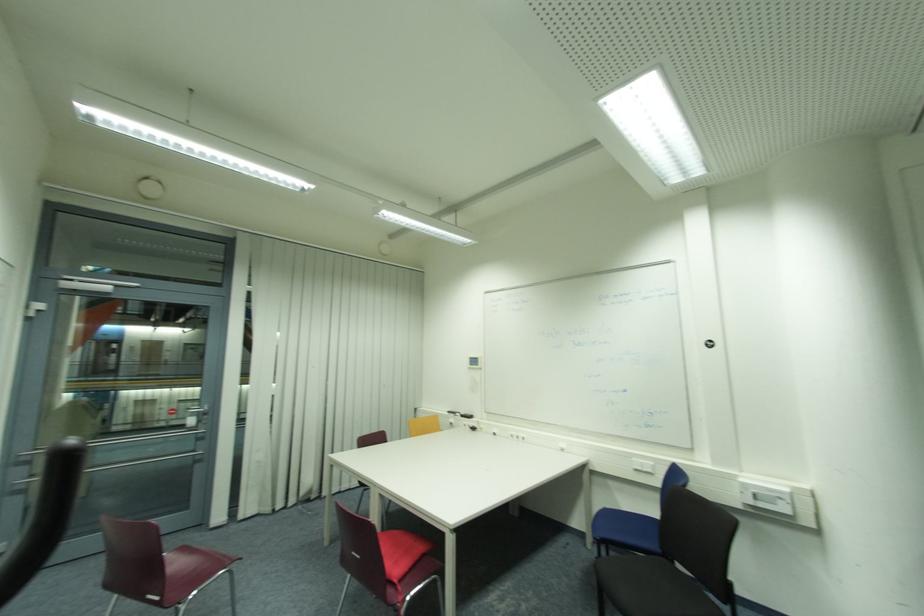
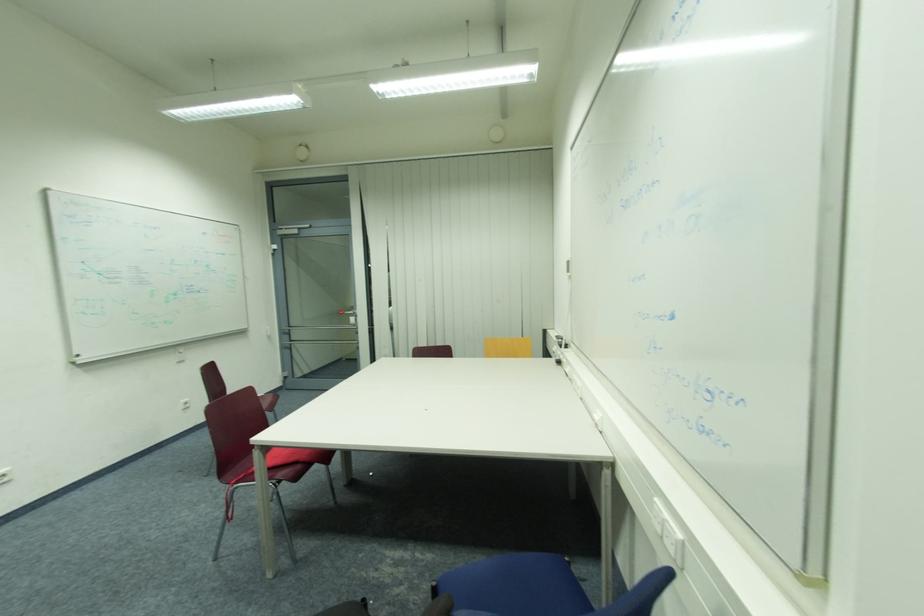
Where in the second image is the point corresponding to (485,419) from the first image?

(578, 352)